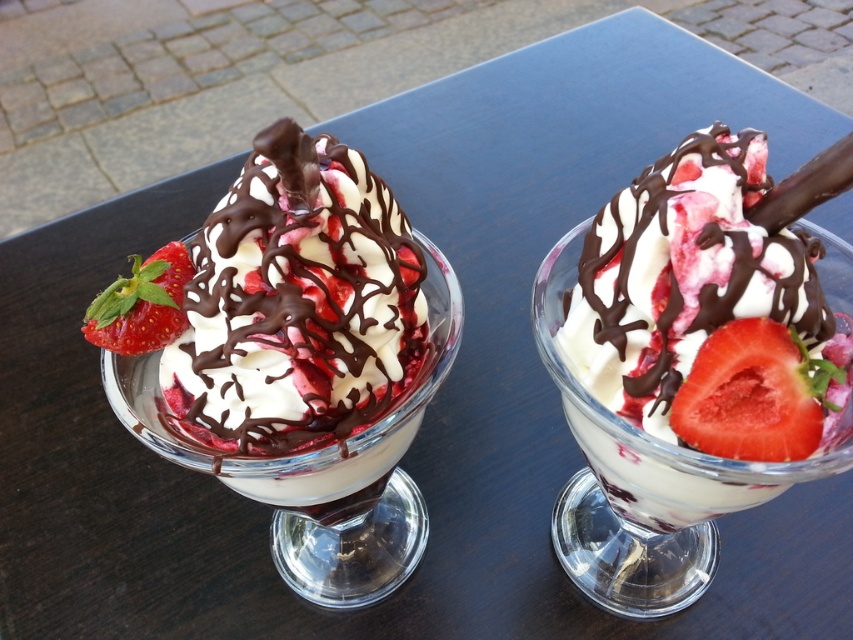
Who is more forward, (200, 312) or (178, 244)?

Point (200, 312) is in front.

Does white glossy ice cream sundae at center come behind red matte strawberry at left?

No, it is in front of red matte strawberry at left.

Is point (231, 317) more distant than point (148, 291)?

No, it is in front of (148, 291).

Where is `white glossy ice cream sundae at center`? The image size is (853, 640). white glossy ice cream sundae at center is located at coordinates (297, 305).

Which is more to the right, white creamy ice cream at center or white glossy ice cream sundae at center?

white creamy ice cream at center is more to the right.

Is white creamy ice cream at center to the right of white glossy ice cream sundae at center from the viewer's perspective?

Yes, white creamy ice cream at center is to the right of white glossy ice cream sundae at center.

Is point (672, 353) positioned before point (383, 268)?

Yes, point (672, 353) is in front of point (383, 268).

Image resolution: width=853 pixels, height=640 pixels. Identify the location of white creamy ice cream at center. (698, 330).

Is point (770, 364) farther from camera compared to point (158, 284)?

No.

Where is `juicy red strawberry at right`? juicy red strawberry at right is located at coordinates (752, 394).